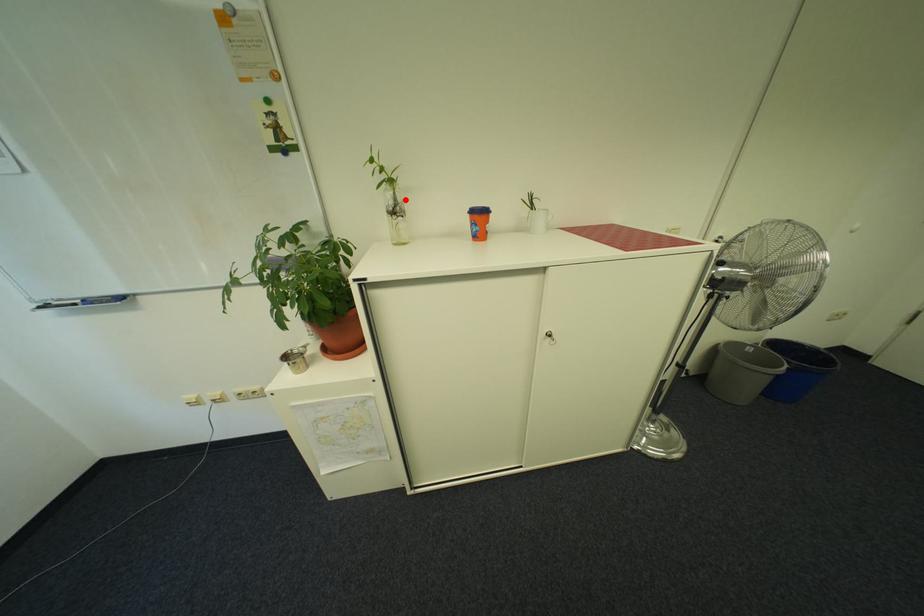
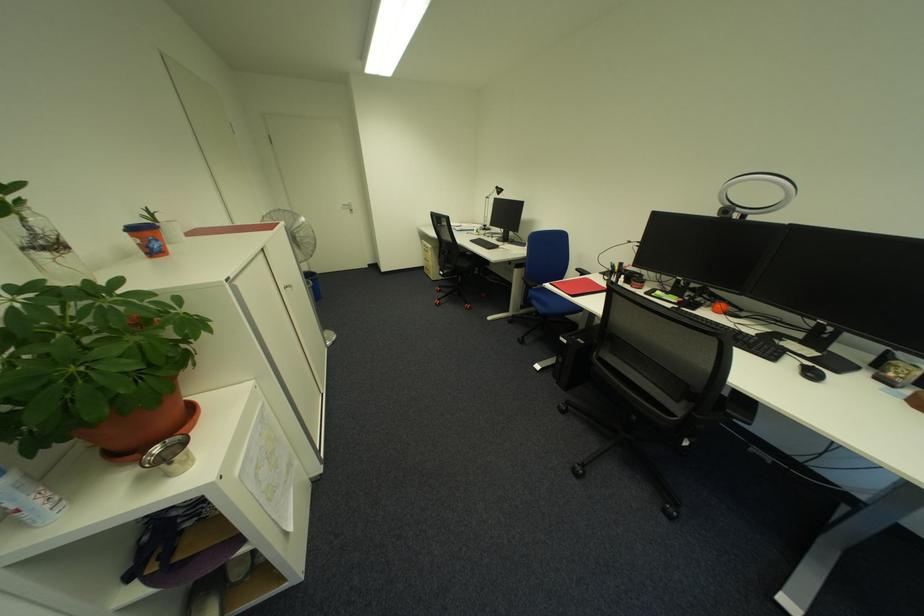
Question: A red point is marked in image1. In image2, is the corresponding 3D point closer to the camera or farther? Reply with the corresponding letter.

Choices:
 (A) The corresponding 3D point is closer.
 (B) The corresponding 3D point is farther.

Answer: (B)